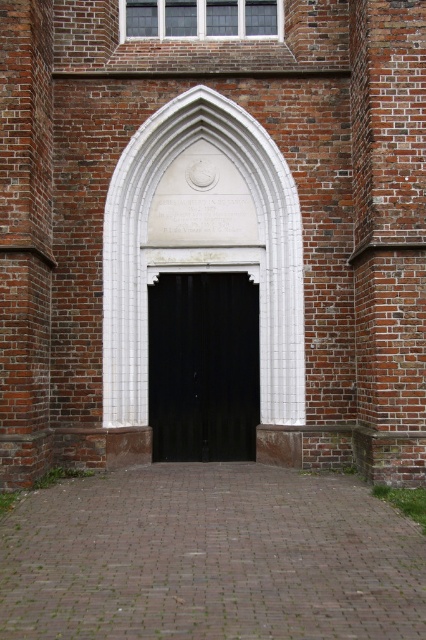
Question: Does white stone archway at center appear over black wooden door at center?

Choices:
 (A) yes
 (B) no

Answer: (A)

Question: Which object is closer to the camera taking this photo?

Choices:
 (A) black wooden door at center
 (B) white stone archway at center

Answer: (B)

Question: Which point is farther to the camera?

Choices:
 (A) black wooden door at center
 (B) white stone archway at center

Answer: (A)

Question: Is white stone archway at center below black wooden door at center?

Choices:
 (A) yes
 (B) no

Answer: (B)

Question: Is white stone archway at center thinner than black wooden door at center?

Choices:
 (A) no
 (B) yes

Answer: (B)